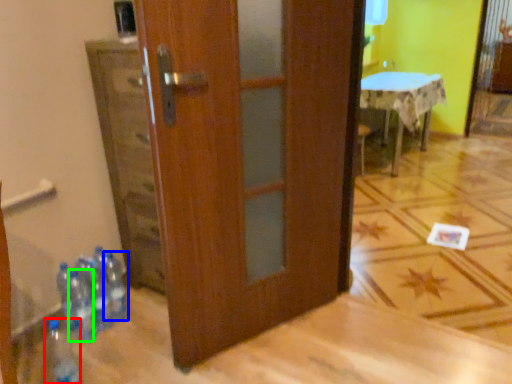
Question: Which is farther away from bottle (highlighted by a red box)? bottle (highlighted by a blue box) or bottle (highlighted by a green box)?

Choices:
 (A) bottle
 (B) bottle

Answer: (A)